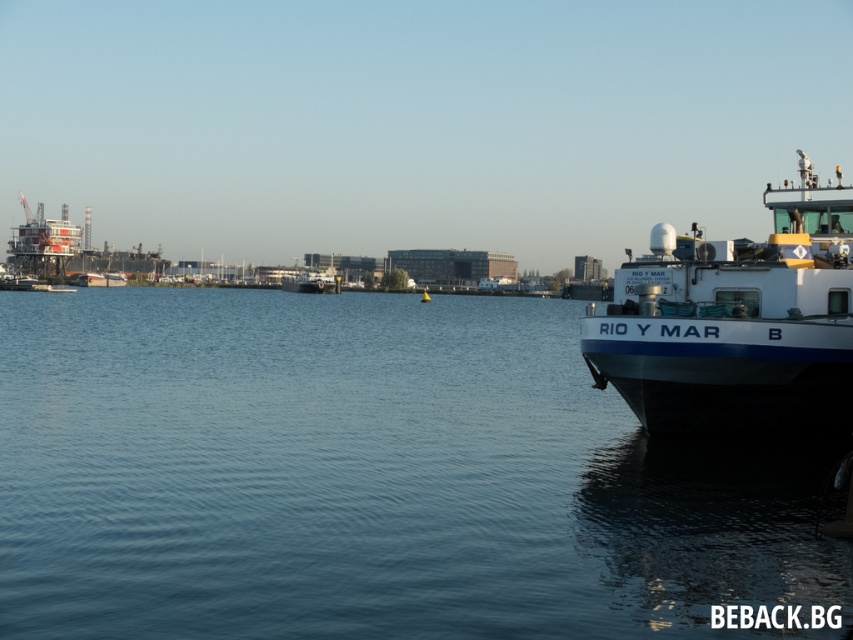
You are a photographer standing on the dock and want to capture the white matte boat at right and the blue water at center in the same frame. Based on their positions, which object should you focus on first to ensure both are in the shot?

The blue water at center is positioned under the white matte boat at right, so focusing on the boat first will naturally include the water in the frame below it.

You are a delivery drone operator. Your drone has a maximum flight range of 150 meters. You need to deliver a package from the white matte boat at right to the reddish metallic structure at upper left. Can the drone complete this delivery without needing to recharge?

The distance between the white matte boat at right and the reddish metallic structure at upper left is 173.57 meters, which exceeds the drone operator stated maximum flight range of 150 meters. The drone cannot complete the delivery without recharging.

You are a photographer planning to capture a sunset shot of the white matte boat at right and the reddish metallic structure at upper left. Based on the scene, will the boat be in the shadow of the structure during the shot?

The white matte boat at right is positioned under the reddish metallic structure at upper left, so during sunset, the structure will cast a shadow on the boat, placing it in shadow.